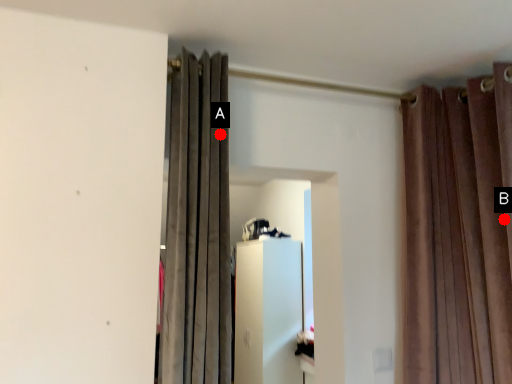
Question: Two points are circled on the image, labeled by A and B beside each circle. Among these points, which one is farthest from the camera?

Choices:
 (A) A is further
 (B) B is further

Answer: (B)